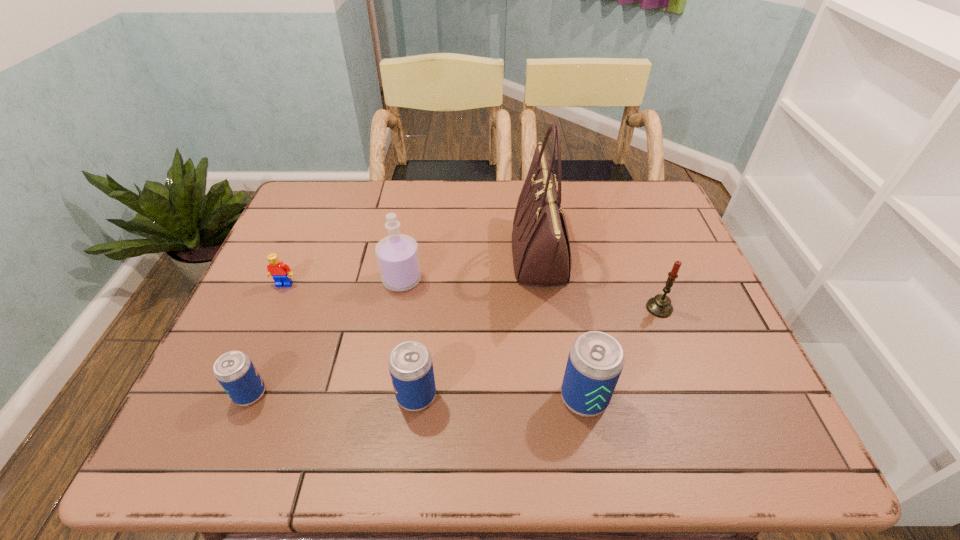
Locate an element on the screen. This screenshot has height=540, width=960. free spot between the sixth shortest object and the rightmost beer can is located at coordinates (493, 339).

Where is `free spot between the second beer can from left to right and the candle`? The width and height of the screenshot is (960, 540). free spot between the second beer can from left to right and the candle is located at coordinates (538, 352).

Identify the location of blank region between the tallest beer can and the second tallest beer can. This screenshot has width=960, height=540. (500, 397).

Find the location of a particular element. unoccupied area between the Lego and the leftmost beer can is located at coordinates (268, 339).

At what (x,y) coordinates should I click in order to perform the action: click on vacant space in between the candle and the tallest object. Please return your answer as a coordinate pair (x, y). This screenshot has height=540, width=960. Looking at the image, I should click on (600, 282).

You are a GUI agent. You are given a task and a screenshot of the screen. Output one action in this format:
    pyautogui.click(x=<x>, y=<y>)
    Task: Click on the object that is the fifth closest to the second tallest beer can
    This screenshot has height=540, width=960.
    Given the screenshot: What is the action you would take?
    [281, 273]

Find the location of a particular element. The height and width of the screenshot is (540, 960). object that can be found as the fourth closest to the second beer can from left to right is located at coordinates (234, 370).

The image size is (960, 540). In order to click on beer can that is the second closest to the leftmost beer can in this screenshot , I will do `click(595, 362)`.

Identify the location of beer can that is the second closest one to the second tallest beer can. (234, 370).

Where is `vacant space that satisfies the following two spatial constraints: 1. on the front side of the rightmost object; 2. on the left side of the perfume`? The width and height of the screenshot is (960, 540). vacant space that satisfies the following two spatial constraints: 1. on the front side of the rightmost object; 2. on the left side of the perfume is located at coordinates (396, 308).